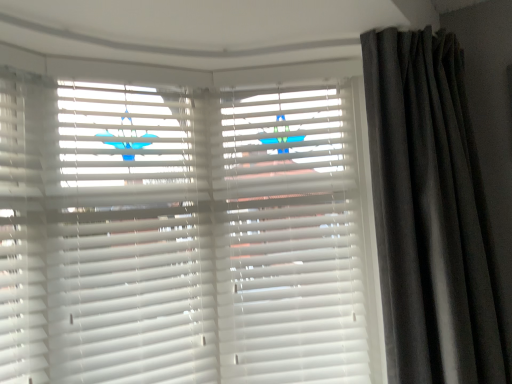
Question: Should I look upward or downward to see dark grey velvet curtain at right?

Choices:
 (A) up
 (B) down

Answer: (B)

Question: Is white matte blinds at center, placed as the 2th shutter when sorted from right to left, wider than white matte shutter at center, positioned as the second shutter in left-to-right order?

Choices:
 (A) yes
 (B) no

Answer: (B)

Question: Can we say white matte blinds at center, the first shutter positioned from the left, lies outside white matte shutter at center, the first shutter when ordered from right to left?

Choices:
 (A) no
 (B) yes

Answer: (B)

Question: Does white matte blinds at center, placed as the 2th shutter when sorted from right to left, appear on the right side of white matte shutter at center, the first shutter when ordered from right to left?

Choices:
 (A) no
 (B) yes

Answer: (A)

Question: From a real-world perspective, is white matte blinds at center, placed as the 2th shutter when sorted from right to left, under white matte shutter at center, positioned as the second shutter in left-to-right order?

Choices:
 (A) yes
 (B) no

Answer: (B)

Question: Are white matte blinds at center, placed as the 2th shutter when sorted from right to left, and white matte shutter at center, positioned as the second shutter in left-to-right order, far apart?

Choices:
 (A) no
 (B) yes

Answer: (A)

Question: Does white matte blinds at center, the first shutter positioned from the left, have a lesser width compared to white matte shutter at center, the first shutter when ordered from right to left?

Choices:
 (A) no
 (B) yes

Answer: (B)

Question: Can you confirm if white matte blinds at center, placed as the 2th shutter when sorted from right to left, is positioned to the right of dark grey velvet curtain at right?

Choices:
 (A) yes
 (B) no

Answer: (B)

Question: Is white matte blinds at center, the first shutter positioned from the left, at the left side of dark grey velvet curtain at right?

Choices:
 (A) no
 (B) yes

Answer: (B)

Question: Does white matte blinds at center, the first shutter positioned from the left, contain dark grey velvet curtain at right?

Choices:
 (A) no
 (B) yes

Answer: (A)

Question: Considering the relative sizes of white matte blinds at center, placed as the 2th shutter when sorted from right to left, and dark grey velvet curtain at right in the image provided, is white matte blinds at center, placed as the 2th shutter when sorted from right to left, wider than dark grey velvet curtain at right?

Choices:
 (A) yes
 (B) no

Answer: (B)

Question: Is white matte blinds at center, placed as the 2th shutter when sorted from right to left, taller than dark grey velvet curtain at right?

Choices:
 (A) yes
 (B) no

Answer: (B)

Question: From a real-world perspective, is white matte blinds at center, placed as the 2th shutter when sorted from right to left, beneath dark grey velvet curtain at right?

Choices:
 (A) yes
 (B) no

Answer: (B)

Question: From a real-world perspective, is dark grey velvet curtain at right located beneath white matte blinds at center, placed as the 2th shutter when sorted from right to left?

Choices:
 (A) no
 (B) yes

Answer: (B)